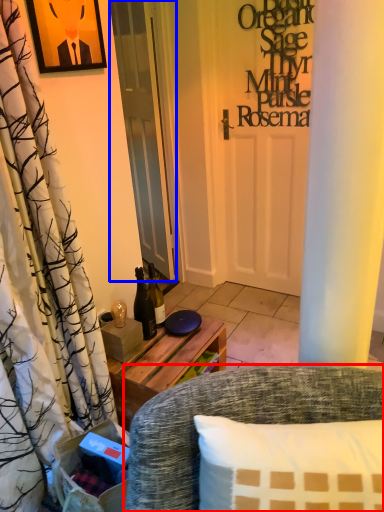
Question: Which object is closer to the camera taking this photo, chair (highlighted by a red box) or door (highlighted by a blue box)?

Choices:
 (A) chair
 (B) door

Answer: (A)